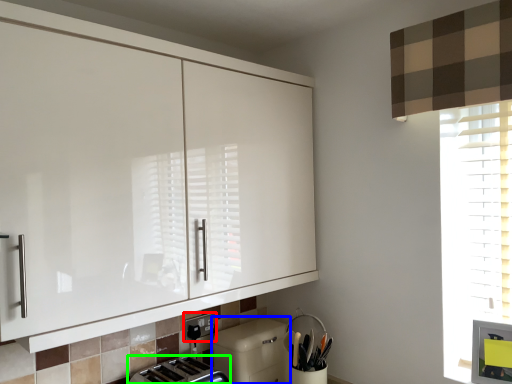
Question: Which is farther away from electric outlet (highlighted by a red box)? dish washer (highlighted by a blue box) or toaster (highlighted by a green box)?

Choices:
 (A) dish washer
 (B) toaster

Answer: (A)